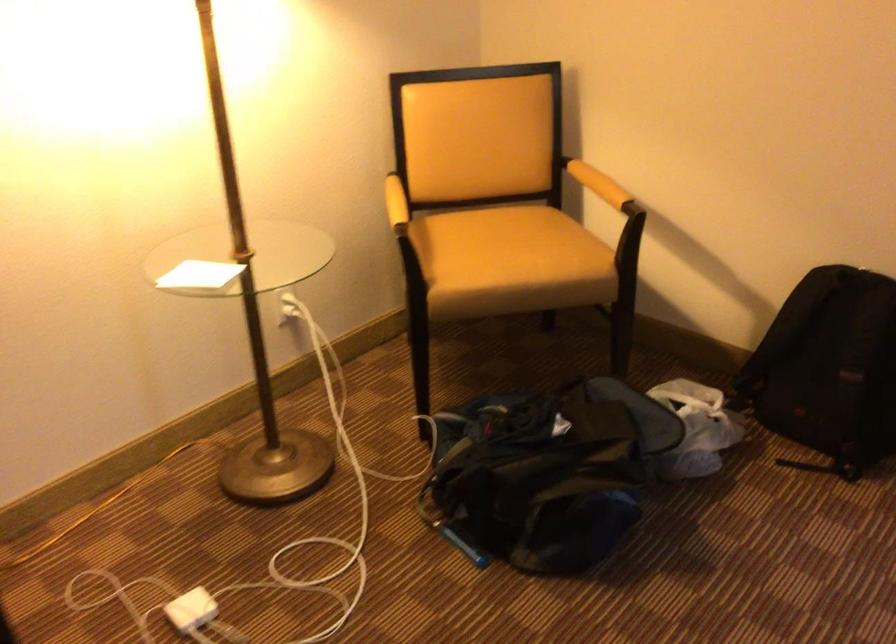
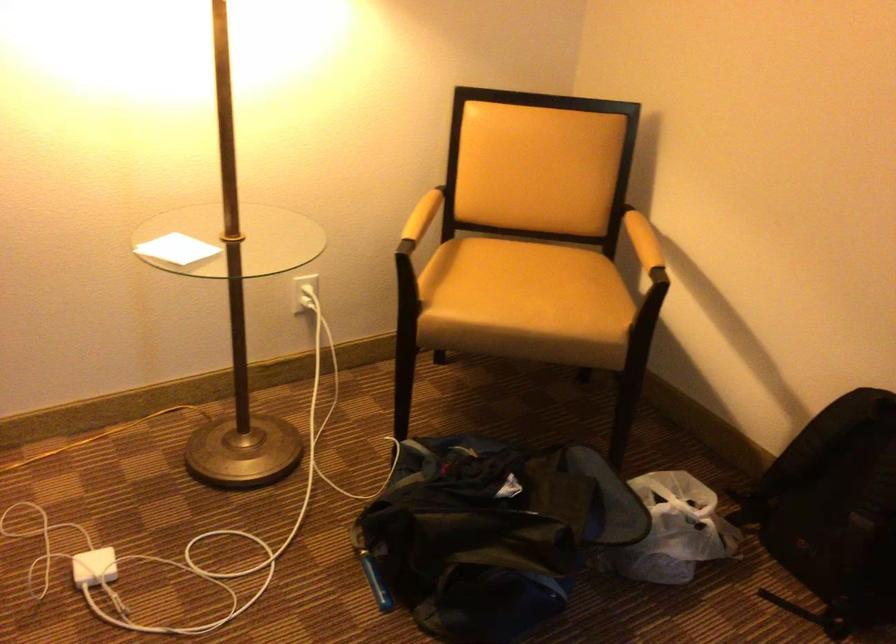
Question: How did the camera likely rotate?

Choices:
 (A) Left
 (B) Right
 (C) Up
 (D) Down

Answer: (A)